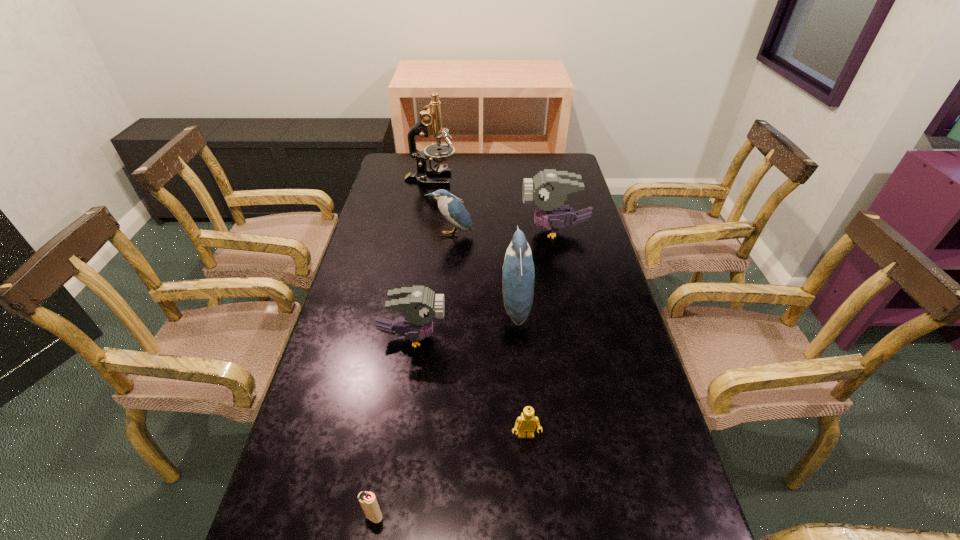
The image size is (960, 540). I want to click on object that stands as the fifth closest to the right blue bird, so tap(367, 500).

Identify which object is the second nearest to the smaller blue bird. Please provide its 2D coordinates. Your answer should be formatted as a tuple, i.e. [(x, y)], where the tuple contains the x and y coordinates of a point satisfying the conditions above.

[(518, 274)]

You are a GUI agent. You are given a task and a screenshot of the screen. Output one action in this format:
    pyautogui.click(x=<x>, y=<y>)
    Task: Click on the fourth closest bird to the microscope
    
    Given the screenshot: What is the action you would take?
    pyautogui.click(x=419, y=305)

Identify which bird is located as the second nearest to the nearer gray bird. Please provide its 2D coordinates. Your answer should be formatted as a tuple, i.e. [(x, y)], where the tuple contains the x and y coordinates of a point satisfying the conditions above.

[(452, 209)]

In order to click on free space in the image that satisfies the following two spatial constraints: 1. at the beak of the farther gray bird; 2. on the face of the second nearest object in this screenshot , I will do `click(598, 436)`.